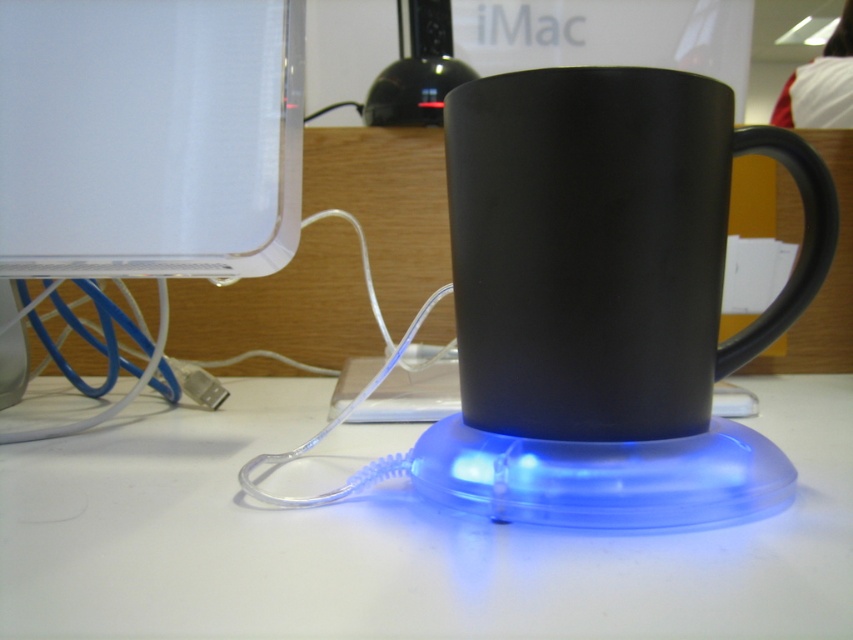
You are setting up a desk organizer and need to know the relative heights of the objects. Which object is shorter between the matte black mug at center and the transparent plastic monitor at upper left?

The matte black mug at center is shorter than the transparent plastic monitor at upper left.

Based on the photo, you are setting up a desk and want to place the transparent plastic base at center and the transparent plastic monitor at upper left. Based on their heights, which one should you place first to ensure stability?

The transparent plastic base at center is shorter than the transparent plastic monitor at upper left. Since the base is shorter, you should place the transparent plastic monitor at upper left first to provide a stable foundation for the base.

You are a delivery person who just arrived at the office to drop off a package. You see the image shown. There is a point at coordinates (393, 540) that marks the transparent plastic base at center. You need to place the package on the desk without blocking the iMac or the USB mug warmer. Where should you place the package?

Place the package on the desk area not occupied by the iMac or the USB mug warmer. Since the transparent plastic base at center is marked at point (393, 540), avoid placing the package near that area. The iMac is on the left side, so placing the package on the right side of the desk away from the mug warmer and iMac would be appropriate.